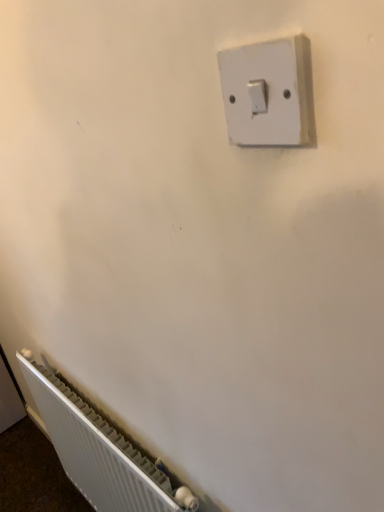
The width and height of the screenshot is (384, 512). What are the coordinates of `white ribbed radiator at lower left` in the screenshot? It's located at (95, 450).

Describe the element at coordinates (95, 450) in the screenshot. I see `white ribbed radiator at lower left` at that location.

Describe the element at coordinates (269, 93) in the screenshot. I see `white plastic light switch at upper center` at that location.

Identify the location of white plastic light switch at upper center. The width and height of the screenshot is (384, 512). (269, 93).

Identify the location of white ribbed radiator at lower left. (95, 450).

Between white plastic light switch at upper center and white ribbed radiator at lower left, which one appears on the left side from the viewer's perspective?

white ribbed radiator at lower left is more to the left.

Which object is further away from the camera, white plastic light switch at upper center or white ribbed radiator at lower left?

white ribbed radiator at lower left is further away from the camera.

Is point (223, 73) farther from camera compared to point (157, 482)?

No, (223, 73) is closer to viewer.

From the image's perspective, is white plastic light switch at upper center located above white ribbed radiator at lower left?

Yes, from the image's perspective, white plastic light switch at upper center is on top of white ribbed radiator at lower left.

From the picture: From a real-world perspective, which object stands above the other?

white plastic light switch at upper center is physically above.

Which of these two, white plastic light switch at upper center or white ribbed radiator at lower left, is wider?

Wider between the two is white ribbed radiator at lower left.

In terms of height, does white plastic light switch at upper center look taller or shorter compared to white ribbed radiator at lower left?

Clearly, white plastic light switch at upper center is shorter compared to white ribbed radiator at lower left.

Who is bigger, white plastic light switch at upper center or white ribbed radiator at lower left?

Bigger between the two is white ribbed radiator at lower left.

Is white plastic light switch at upper center inside or outside of white ribbed radiator at lower left?

white plastic light switch at upper center exists outside the volume of white ribbed radiator at lower left.

Is white plastic light switch at upper center not near white ribbed radiator at lower left?

Yes.

Is white plastic light switch at upper center oriented away from white ribbed radiator at lower left?

white plastic light switch at upper center does not have its back to white ribbed radiator at lower left.

How distant is white plastic light switch at upper center from white ribbed radiator at lower left?

white plastic light switch at upper center and white ribbed radiator at lower left are 1.09 meters apart from each other.

The image size is (384, 512). In order to click on light switch to the right of white ribbed radiator at lower left in this screenshot , I will do `click(269, 93)`.

Which is more to the right, white ribbed radiator at lower left or white plastic light switch at upper center?

white plastic light switch at upper center is more to the right.

In the image, is white ribbed radiator at lower left positioned in front of or behind white plastic light switch at upper center?

In the image, white ribbed radiator at lower left appears behind white plastic light switch at upper center.

Is point (64, 410) positioned after point (259, 91)?

Yes, it is.

From the image's perspective, is white ribbed radiator at lower left over white plastic light switch at upper center?

No, from the image's perspective, white ribbed radiator at lower left is not on top of white plastic light switch at upper center.

From a real-world perspective, is white ribbed radiator at lower left located higher than white plastic light switch at upper center?

No, from a real-world perspective, white ribbed radiator at lower left is not over white plastic light switch at upper center

Does white ribbed radiator at lower left have a lesser width compared to white plastic light switch at upper center?

Incorrect, the width of white ribbed radiator at lower left is not less than that of white plastic light switch at upper center.

Does white ribbed radiator at lower left have a lesser height compared to white plastic light switch at upper center?

No, white ribbed radiator at lower left is not shorter than white plastic light switch at upper center.

Looking at the image, does white ribbed radiator at lower left seem bigger or smaller compared to white plastic light switch at upper center?

In the image, white ribbed radiator at lower left appears to be larger than white plastic light switch at upper center.

Is white plastic light switch at upper center located within white ribbed radiator at lower left?

No, white ribbed radiator at lower left does not contain white plastic light switch at upper center.

Looking at this image, is white ribbed radiator at lower left not near white plastic light switch at upper center?

That's right, there is a large distance between white ribbed radiator at lower left and white plastic light switch at upper center.

Could you tell me if white ribbed radiator at lower left is facing white plastic light switch at upper center?

No, white ribbed radiator at lower left does not turn towards white plastic light switch at upper center.

Measure the distance between white ribbed radiator at lower left and white plastic light switch at upper center.

white ribbed radiator at lower left and white plastic light switch at upper center are 1.09 meters apart.

In the image, there is a white plastic light switch at upper center. Identify the location of radiator below it (from a real-world perspective). (95, 450).

This screenshot has width=384, height=512. In order to click on radiator behind the white plastic light switch at upper center in this screenshot , I will do `click(95, 450)`.

The height and width of the screenshot is (512, 384). I want to click on light switch on the right of white ribbed radiator at lower left, so click(269, 93).